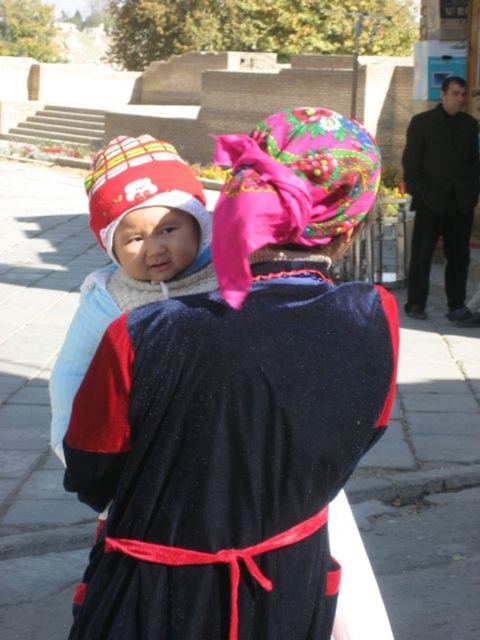
Question: Which is nearer to the matte red knit hat at left?

Choices:
 (A) black matte robe at right
 (B) velvet dark blue dress at center

Answer: (B)

Question: Which object is positioned farthest from the black matte robe at right?

Choices:
 (A) matte red knit hat at left
 (B) velvet dark blue dress at center

Answer: (B)

Question: Does velvet dark blue dress at center have a greater width compared to black matte robe at right?

Choices:
 (A) no
 (B) yes

Answer: (A)

Question: Can you confirm if velvet dark blue dress at center is positioned below matte red knit hat at left?

Choices:
 (A) no
 (B) yes

Answer: (B)

Question: Which point is farther to the camera?

Choices:
 (A) (172, 193)
 (B) (245, 394)

Answer: (A)

Question: Is velvet dark blue dress at center bigger than matte red knit hat at left?

Choices:
 (A) yes
 (B) no

Answer: (A)